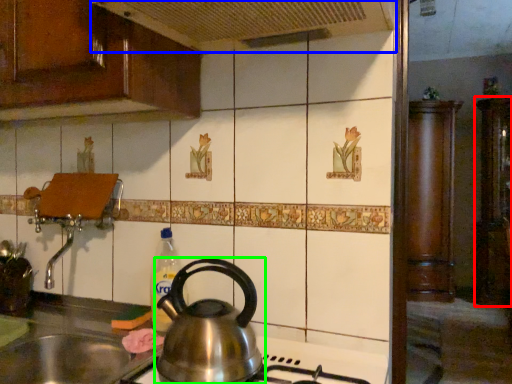
Question: Which object is positioned farthest from cabinetry (highlighted by a red box)? Select from exhaust hood (highlighted by a blue box) and kettle (highlighted by a green box).

Choices:
 (A) exhaust hood
 (B) kettle

Answer: (B)